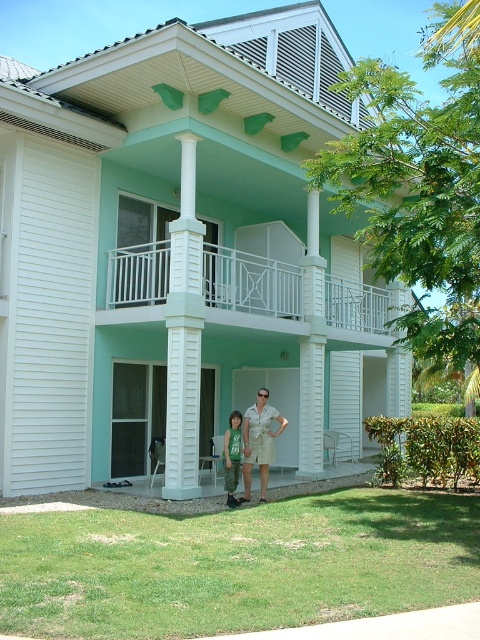
You are standing on the lawn in front of the house. You want to take a photo of the white matte balcony at upper center. Which direction should you face to ensure the balcony is centered in your camera view?

The white matte balcony at upper center is located at coordinates point (253, 289), so facing the upper center direction will center it in your camera view.

You are a delivery person holding a package that requires a 2.5 meter clearance to deliver. You need to pass between the white smooth column at center and the khaki shorts at center. Can you safely pass through this space with your package?

The distance between the white smooth column at center and the khaki shorts at center is 2.68 meters, which is wider than the 2.5 meter clearance needed. Therefore, you can safely pass through this space with the package.